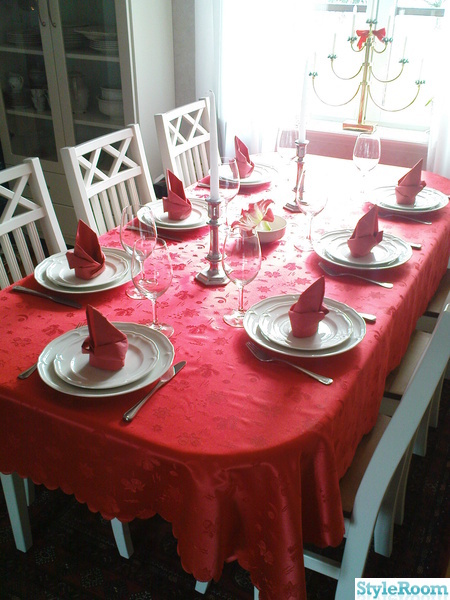
Where is `decoratively folded red napkin`? decoratively folded red napkin is located at coordinates (406, 192), (240, 154), (177, 205), (89, 247), (103, 337), (303, 302), (367, 239).